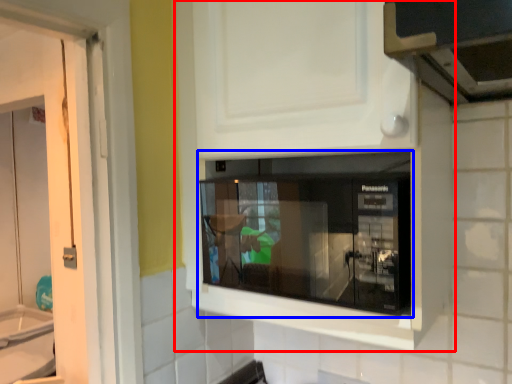
Question: Which of the following is the closest to the observer, cabinetry (highlighted by a red box) or microwave oven (highlighted by a blue box)?

Choices:
 (A) cabinetry
 (B) microwave oven

Answer: (A)